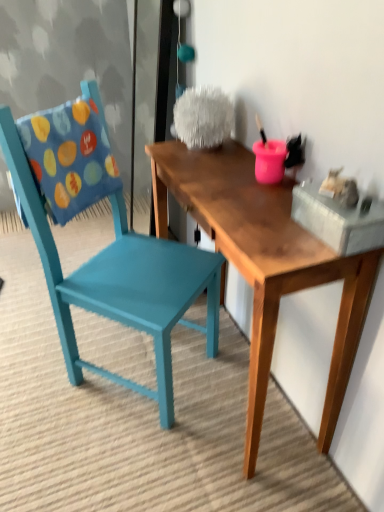
Question: Considering their positions, is teal painted wood chair at left located in front of or behind blue fabric pillow at left?

Choices:
 (A) behind
 (B) front

Answer: (B)

Question: From the image's perspective, is teal painted wood chair at left positioned above or below blue fabric pillow at left?

Choices:
 (A) below
 (B) above

Answer: (A)

Question: Which is nearer to the blue fabric pillow at left?

Choices:
 (A) wooden table at center
 (B) teal painted wood chair at left

Answer: (B)

Question: Considering the real-world distances, which object is farthest from the teal painted wood chair at left?

Choices:
 (A) blue fabric pillow at left
 (B) wooden table at center

Answer: (B)